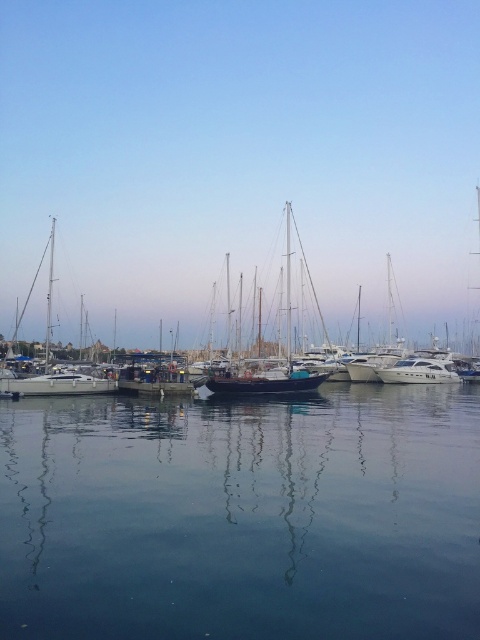
Which is behind, point (418, 433) or point (48, 291)?

The point (48, 291) is more distant.

Between point (192, 577) and point (70, 372), which one is positioned in front?

Point (192, 577) is more forward.

Does point (403, 460) come behind point (87, 384)?

No, it is not.

I want to click on clear blue water at center, so click(241, 516).

From the picture: Who is higher up, dark blue wooden sailboat at center or white glossy yacht at center?

dark blue wooden sailboat at center is above.

Can you confirm if dark blue wooden sailboat at center is positioned to the left of white glossy yacht at center?

Yes, dark blue wooden sailboat at center is to the left of white glossy yacht at center.

Is point (322, 372) closer to camera compared to point (407, 362)?

Yes, point (322, 372) is in front of point (407, 362).

This screenshot has width=480, height=640. Find the location of `dark blue wooden sailboat at center`. dark blue wooden sailboat at center is located at coordinates tap(187, 368).

Is white glossy sailboat at left to the right of white glossy yacht at center from the viewer's perspective?

No, white glossy sailboat at left is not to the right of white glossy yacht at center.

Does point (52, 248) come closer to viewer compared to point (436, 371)?

No.

Is point (72, 394) closer to camera compared to point (444, 364)?

That is True.

At what (x,y) coordinates should I click in order to perform the action: click on white glossy sailboat at left. Please return your answer as a coordinate pair (x, y). The width and height of the screenshot is (480, 640). Looking at the image, I should click on (49, 362).